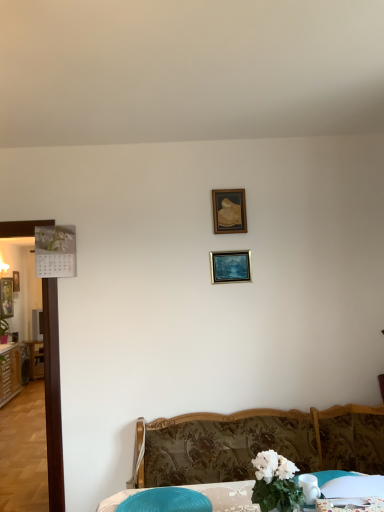
Question: Is metallic silver picture frame at center, acting as the third picture frame starting from the bottom, located within green leafy plant at left?

Choices:
 (A) no
 (B) yes

Answer: (A)

Question: From a real-world perspective, is green leafy plant at left below metallic silver picture frame at center, the 3th picture frame when ordered from left to right?

Choices:
 (A) yes
 (B) no

Answer: (A)

Question: Does green leafy plant at left have a greater width compared to metallic silver picture frame at center, the first picture frame positioned from the front?

Choices:
 (A) no
 (B) yes

Answer: (B)

Question: Is green leafy plant at left positioned in front of metallic silver picture frame at center, which is the 2th picture frame in right-to-left order?

Choices:
 (A) no
 (B) yes

Answer: (A)

Question: Is green leafy plant at left turned away from metallic silver picture frame at center, the first picture frame positioned from the front?

Choices:
 (A) no
 (B) yes

Answer: (A)

Question: Is green leafy plant at left thinner than metallic silver picture frame at center, placed as the 2th picture frame when sorted from top to bottom?

Choices:
 (A) no
 (B) yes

Answer: (A)

Question: Is metallic silver picture frame at left, which appears as the second picture frame when viewed from the left, beside wooden picture frame at upper center, which ranks as the 4th picture frame in left-to-right order?

Choices:
 (A) no
 (B) yes

Answer: (A)

Question: Is metallic silver picture frame at left, the 1th picture frame from the bottom, not close to wooden picture frame at upper center, which ranks as the 4th picture frame in left-to-right order?

Choices:
 (A) no
 (B) yes

Answer: (B)

Question: From the image's perspective, does metallic silver picture frame at left, which is the third picture frame in front-to-back order, appear higher than wooden picture frame at upper center, which appears as the 1th picture frame when viewed from the right?

Choices:
 (A) yes
 (B) no

Answer: (B)

Question: Could you tell me if metallic silver picture frame at left, placed as the 2th picture frame when sorted from back to front, is facing wooden picture frame at upper center, which ranks as the 4th picture frame in left-to-right order?

Choices:
 (A) no
 (B) yes

Answer: (A)

Question: Is metallic silver picture frame at left, the third picture frame from the right, further to camera compared to wooden picture frame at upper center, which appears as the 1th picture frame when viewed from the right?

Choices:
 (A) no
 (B) yes

Answer: (B)

Question: Is metallic silver picture frame at left, placed as the 2th picture frame when sorted from back to front, to the left of wooden picture frame at upper center, which appears as the 2th picture frame when viewed from the front, from the viewer's perspective?

Choices:
 (A) no
 (B) yes

Answer: (B)

Question: Is the depth of blue plastic swivel chair at lower center less than that of green leafy plant at left?

Choices:
 (A) no
 (B) yes

Answer: (B)